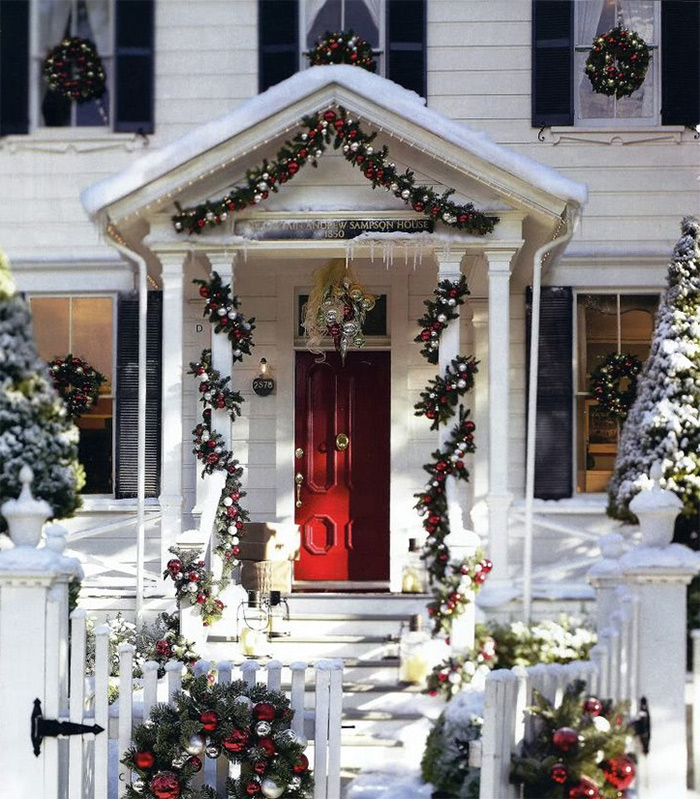
At what (x,y) coordinates should I click in order to perform the action: click on lights. Please return your answer as a coordinate pair (x, y). This screenshot has height=799, width=700. Looking at the image, I should click on (397, 653), (257, 644).